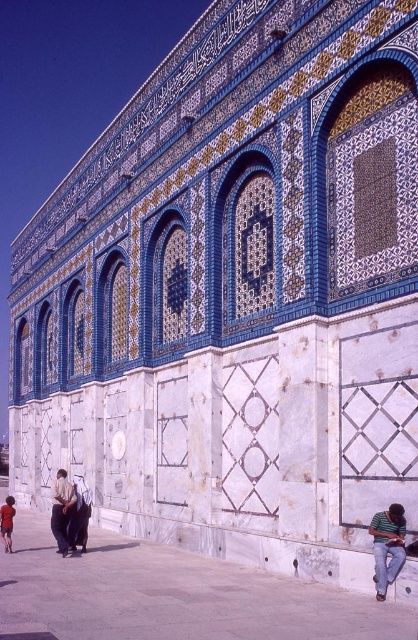
Which is below, green t-shirt at lower right or dark brown leather jacket at lower left?

dark brown leather jacket at lower left is below.

What do you see at coordinates (387, 547) in the screenshot?
I see `green t-shirt at lower right` at bounding box center [387, 547].

Who is more distant from viewer, (395, 552) or (69, 502)?

The point (69, 502) is behind.

What are the coordinates of `green t-shirt at lower right` in the screenshot? It's located at (387, 547).

Locate an element on the screen. The image size is (418, 640). dark brown leather jacket at lower left is located at coordinates (61, 509).

Identify the location of dark brown leather jacket at lower left. This screenshot has width=418, height=640. (61, 509).

Between point (372, 532) and point (12, 502), which one is positioned behind?

The point (12, 502) is behind.

What do you see at coordinates (387, 547) in the screenshot? I see `green t-shirt at lower right` at bounding box center [387, 547].

Which is behind, point (374, 528) or point (7, 541)?

Point (7, 541)

You are a GUI agent. You are given a task and a screenshot of the screen. Output one action in this format:
    pyautogui.click(x=<x>, y=<y>)
    Task: Click on the green t-shirt at lower right
    This screenshot has height=640, width=418.
    Given the screenshot: What is the action you would take?
    pyautogui.click(x=387, y=547)